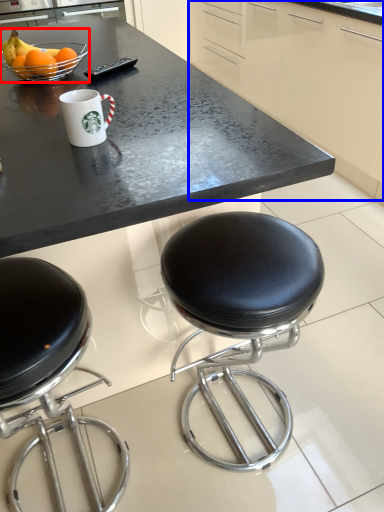
Question: Which object is further to the camera taking this photo, bowl (highlighted by a red box) or cabinetry (highlighted by a blue box)?

Choices:
 (A) bowl
 (B) cabinetry

Answer: (B)